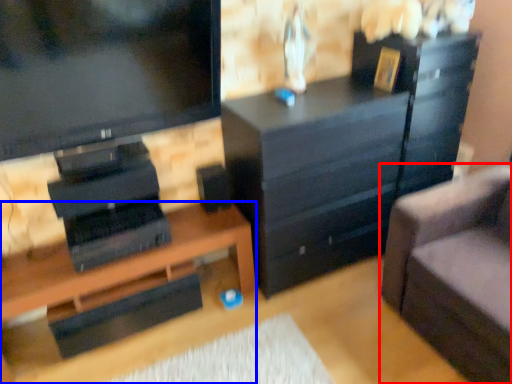
Question: Among these objects, which one is nearest to the camera, studio couch (highlighted by a red box) or desk (highlighted by a blue box)?

Choices:
 (A) studio couch
 (B) desk

Answer: (A)